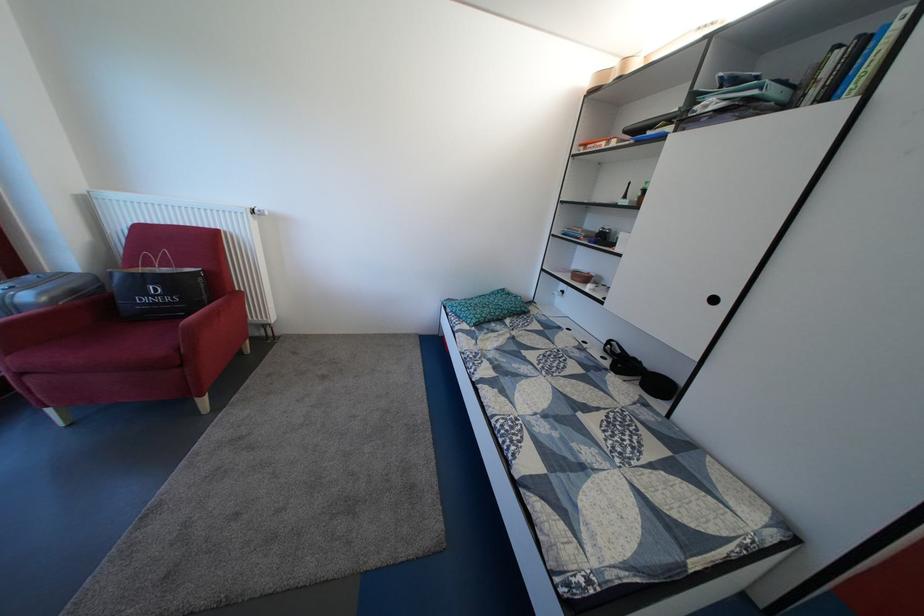
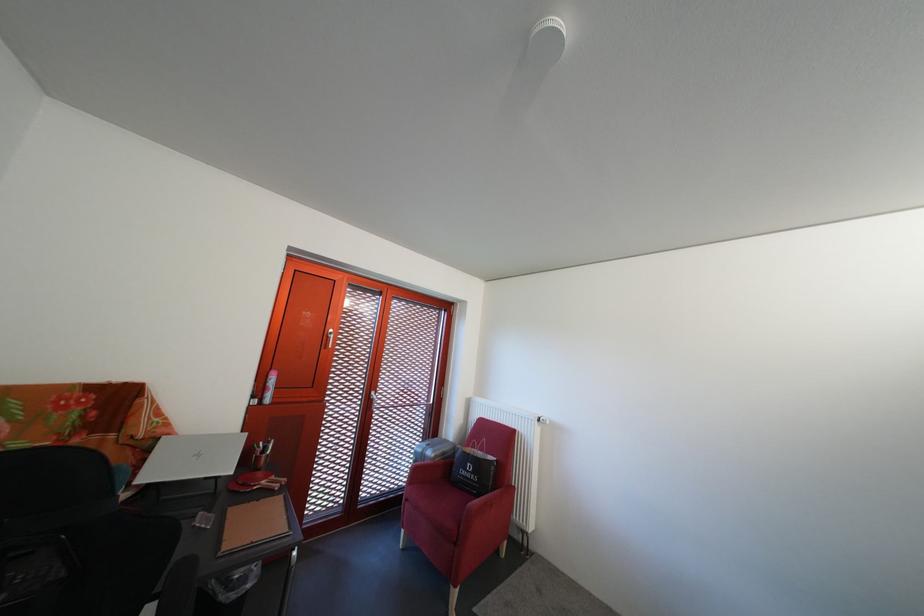
Find the pixel in the second image that matches [84,298] in the first image.

(455, 460)